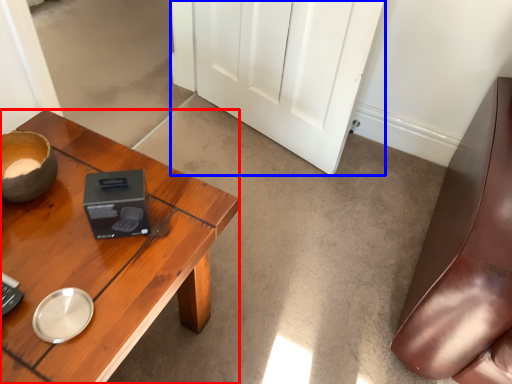
Question: Among these objects, which one is farthest to the camera, desk (highlighted by a red box) or door (highlighted by a blue box)?

Choices:
 (A) desk
 (B) door

Answer: (B)